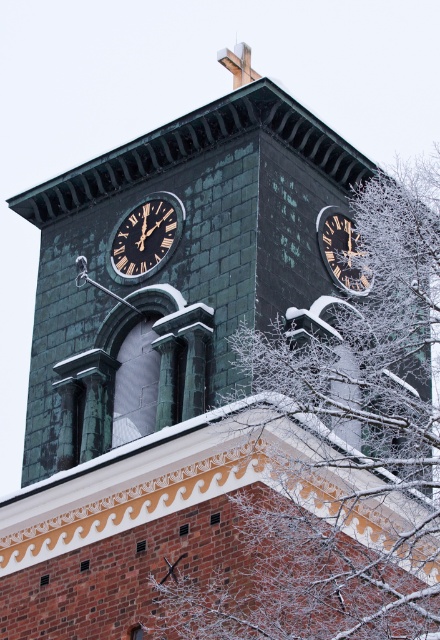
Question: Is dark brown wooden clock at center below gold-toned metal clock at upper right?

Choices:
 (A) no
 (B) yes

Answer: (A)

Question: Is the position of dark brown wooden clock at center more distant than that of gold-toned metal clock at upper right?

Choices:
 (A) no
 (B) yes

Answer: (A)

Question: Among these points, which one is nearest to the camera?

Choices:
 (A) pos(157,244)
 (B) pos(359,280)

Answer: (A)

Question: Does dark brown wooden clock at center appear over gold-toned metal clock at upper right?

Choices:
 (A) no
 (B) yes

Answer: (B)

Question: Which point appears farthest from the camera in this image?

Choices:
 (A) pos(135,259)
 (B) pos(347,241)

Answer: (B)